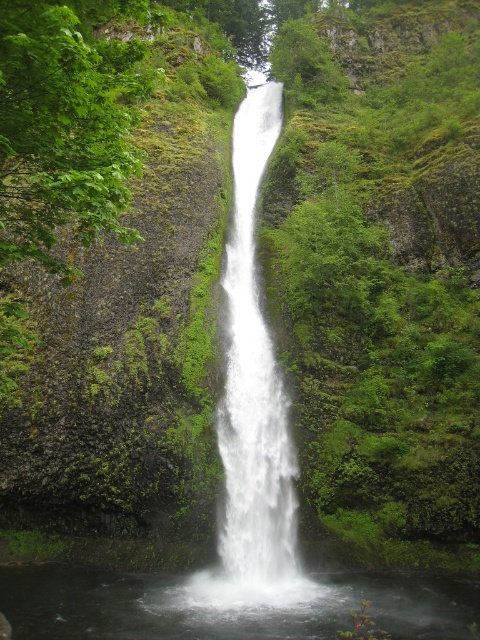
Is clear water at center positioned before white smooth waterfall at center?

That is True.

Does point (57, 605) come farther from viewer compared to point (251, 157)?

No, it is not.

Is point (383, 612) closer to camera compared to point (252, 252)?

Yes, point (383, 612) is closer to viewer.

You are a GUI agent. You are given a task and a screenshot of the screen. Output one action in this format:
    pyautogui.click(x=<x>, y=<y>)
    Task: Click on the clear water at center
    The image size is (480, 640).
    Given the screenshot: What is the action you would take?
    pyautogui.click(x=228, y=605)